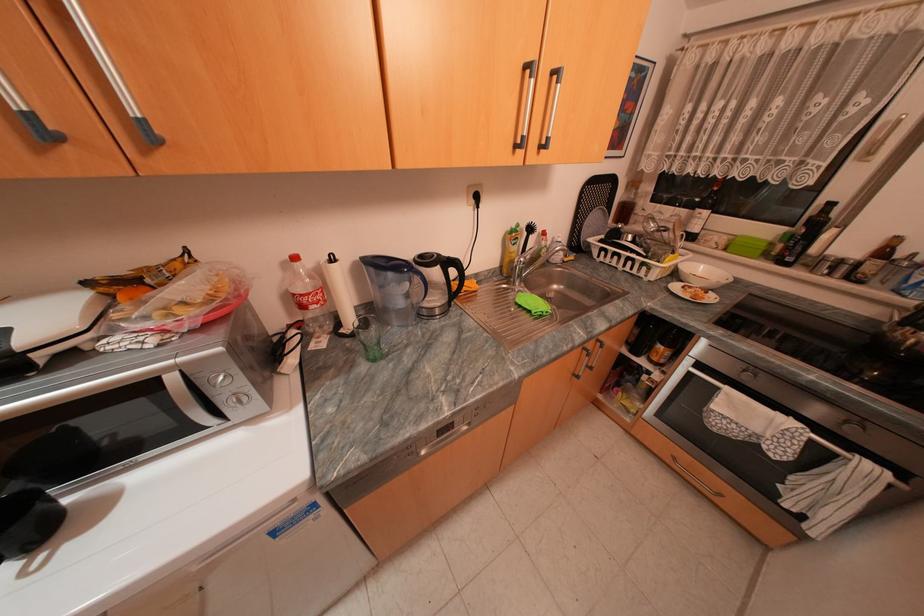
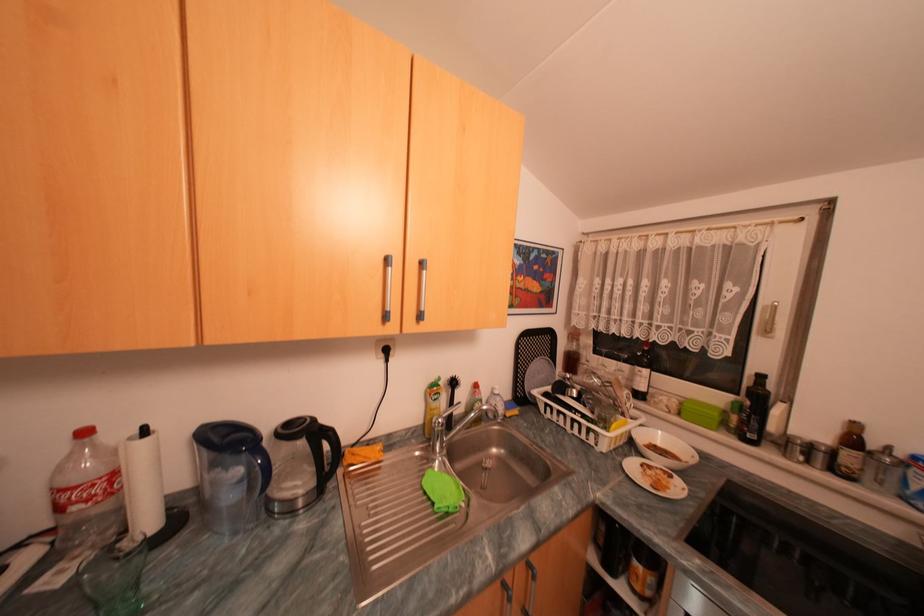
In the second image, find the point that corresponds to [675,233] in the first image.

(622, 389)